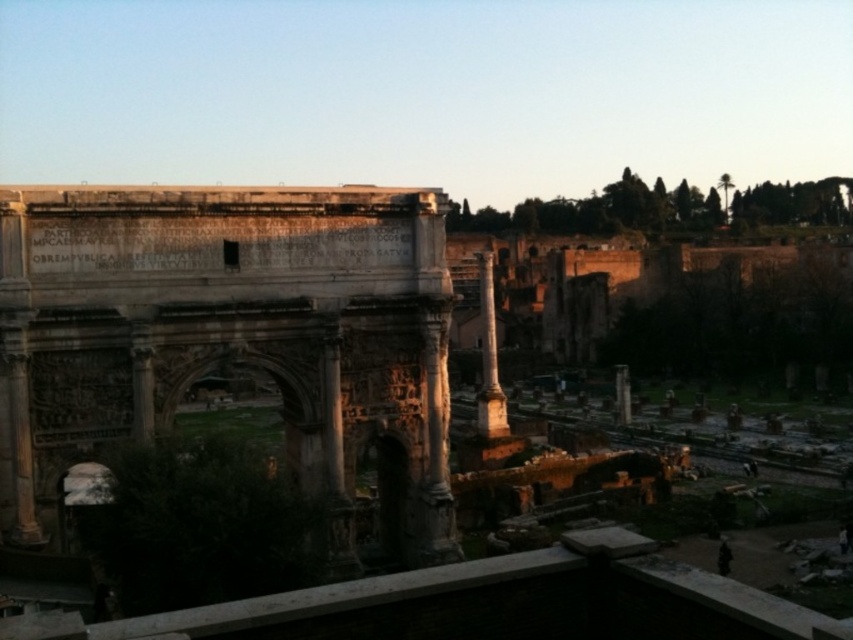
Question: Can you confirm if gray stone arch at center is smaller than smooth stone pillar at center?

Choices:
 (A) no
 (B) yes

Answer: (A)

Question: Is gray stone arch at center wider than white marble column at center?

Choices:
 (A) yes
 (B) no

Answer: (A)

Question: Which is farther from the white marble column at center?

Choices:
 (A) gray stone arch at center
 (B) smooth stone pillar at center

Answer: (A)

Question: Can you confirm if white marble column at center is positioned above smooth stone pillar at center?

Choices:
 (A) yes
 (B) no

Answer: (A)

Question: Which point is closer to the camera?

Choices:
 (A) (628, 410)
 (B) (329, 340)
 (C) (492, 433)

Answer: (B)

Question: Estimate the real-world distances between objects in this image. Which object is closer to the gray stone arch at center?

Choices:
 (A) white marble column at center
 (B) smooth stone pillar at center

Answer: (A)